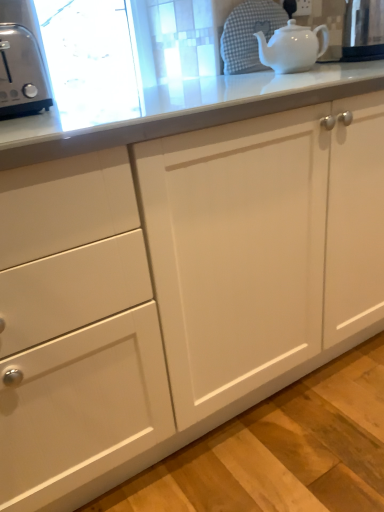
I want to click on vacant space to the right of satin silver toaster at left, so 99,106.